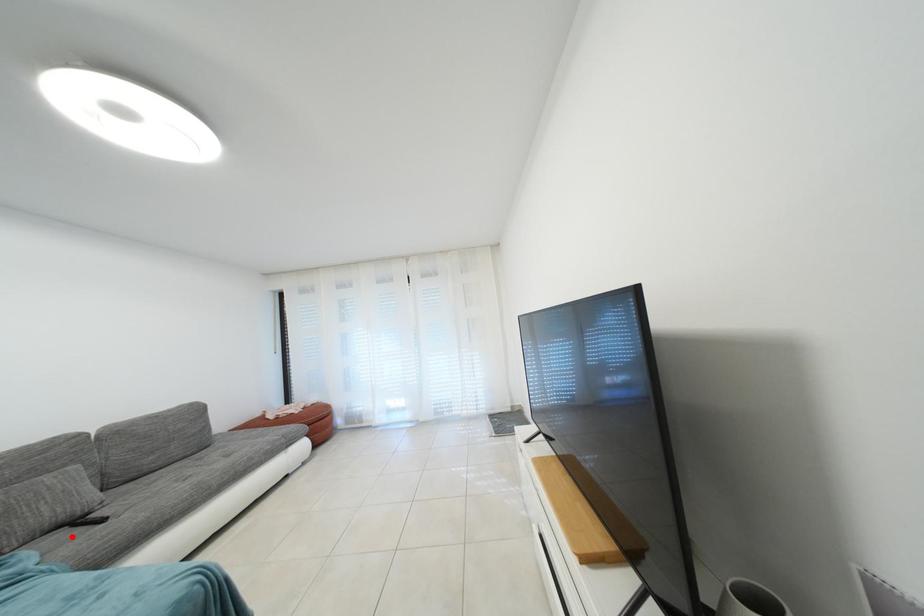
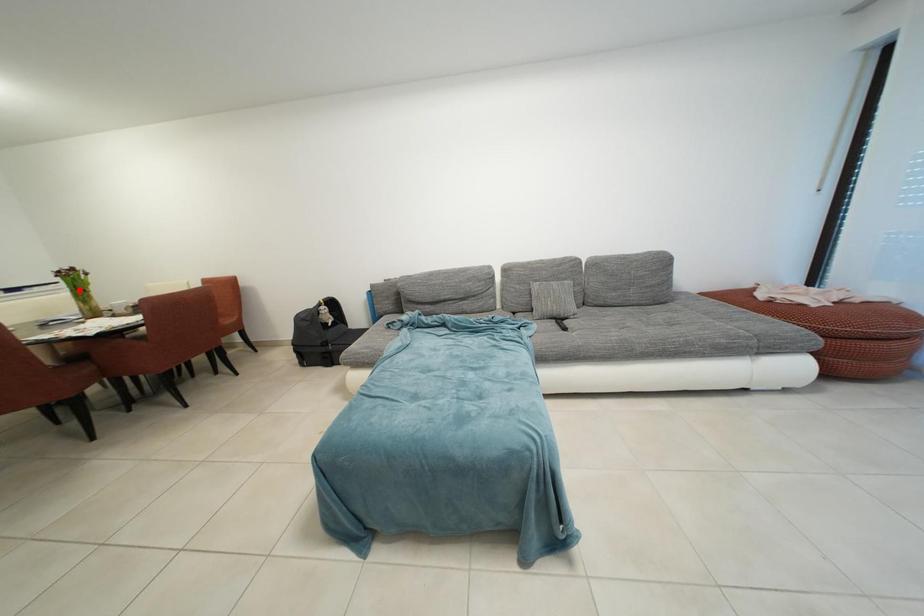
I am providing you with two images of the same scene from different viewpoints. A red point is marked on the first image and another point is marked on the second image. Is the marked point in image1 the same physical position as the marked point in image2?

No